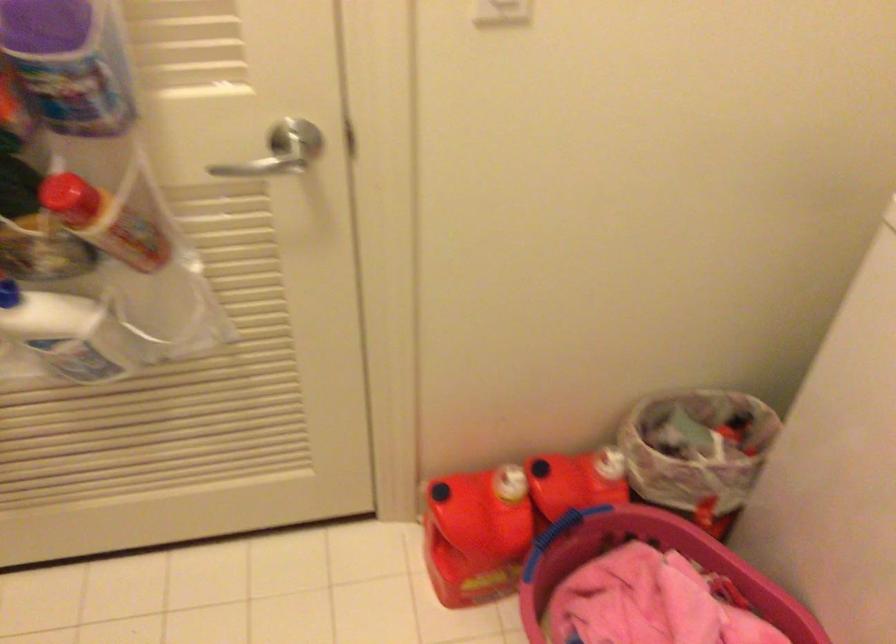
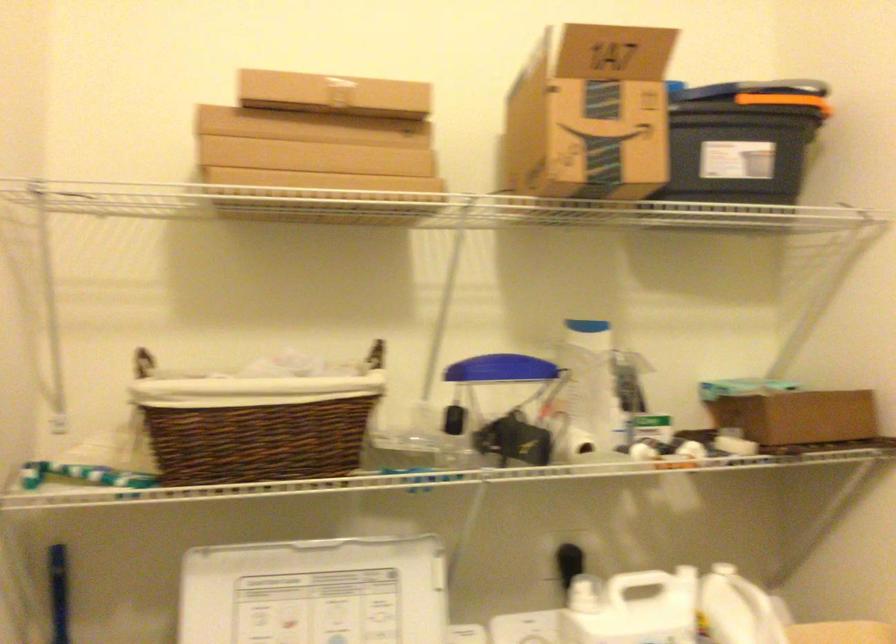
Question: How did the camera likely rotate?

Choices:
 (A) Left
 (B) Right
 (C) Up
 (D) Down

Answer: (B)